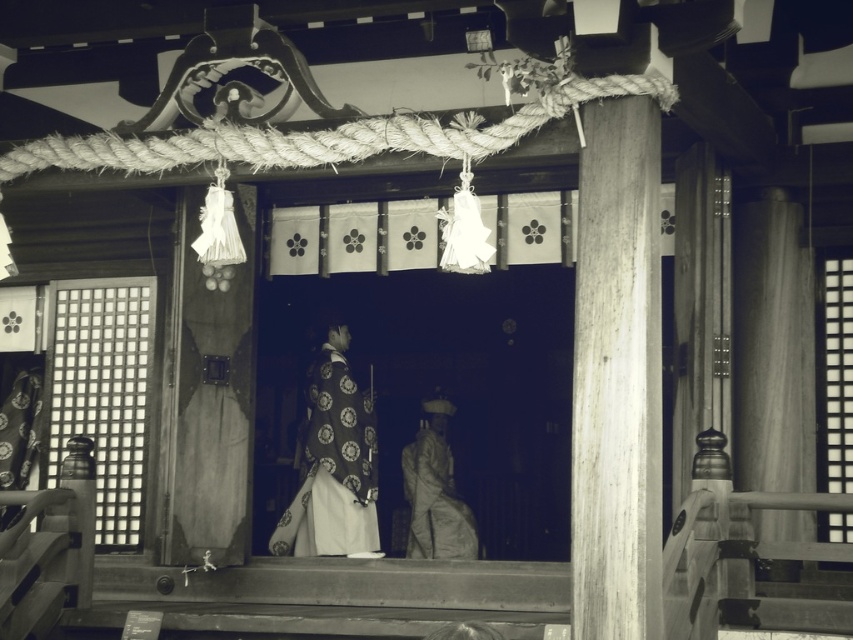
You are standing in front of the traditional Japanese shrine entrance and notice a silky white kimono at center. Based on its position, can you determine if it is placed above or below the horizontal rope with white tassels?

The silky white kimono at center is located at point coordinates that are below the horizontal rope with white tassels. Since the kimono is at center, it is positioned below the rope which is at the top of the entrance. Therefore, the silky white kimono at center is below the horizontal rope with white tassels.